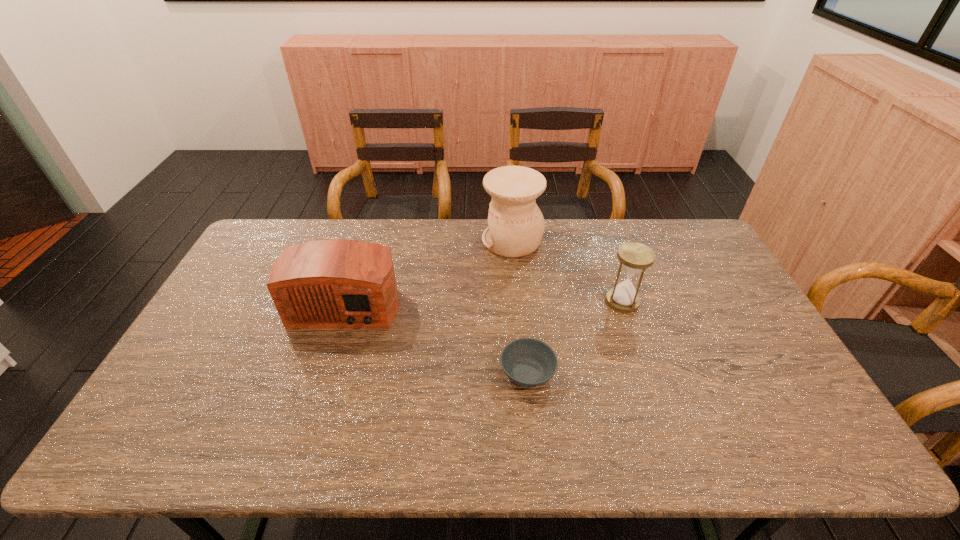
You are a GUI agent. You are given a task and a screenshot of the screen. Output one action in this format:
    pyautogui.click(x=<x>, y=<y>)
    Task: Click on the vacant area that lies between the soup bowl and the radio receiver
    This screenshot has width=960, height=540.
    Given the screenshot: What is the action you would take?
    pyautogui.click(x=437, y=337)

I want to click on free spot between the rightmost object and the leftmost object, so click(x=484, y=301).

In order to click on blank region between the leftmost object and the hourglass in this screenshot , I will do `click(484, 301)`.

This screenshot has width=960, height=540. Find the location of `vacant area between the radio receiver and the rightmost object`. vacant area between the radio receiver and the rightmost object is located at coordinates (484, 301).

What are the coordinates of `blank region between the hourglass and the radio receiver` in the screenshot? It's located at (484, 301).

At what (x,y) coordinates should I click in order to perform the action: click on free space between the leftmost object and the hourglass. Please return your answer as a coordinate pair (x, y). Looking at the image, I should click on (484, 301).

Locate an element on the screen. vacant region between the shortest object and the radio receiver is located at coordinates (437, 337).

The height and width of the screenshot is (540, 960). I want to click on vacant space in between the nearest object and the tallest object, so click(x=520, y=307).

Where is `free space between the shortest object and the pottery`? free space between the shortest object and the pottery is located at coordinates (520, 307).

This screenshot has width=960, height=540. Identify the location of object that is the third closest to the radio receiver. (634, 258).